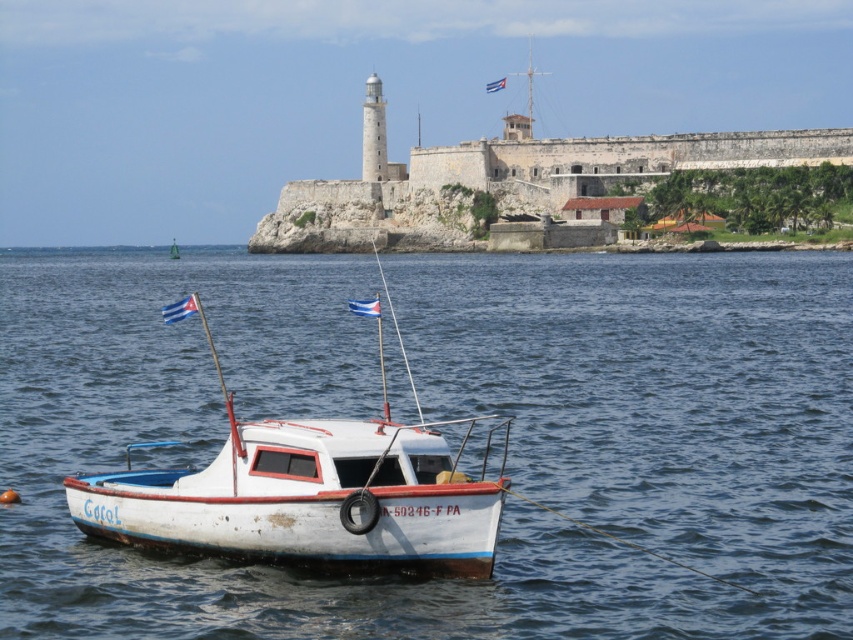
Looking at this image, does white water at boat front come in front of white matte boat at center?

Yes, white water at boat front is closer to the viewer.

This screenshot has width=853, height=640. In order to click on white water at boat front in this screenshot , I will do [447, 417].

Between point (703, 582) and point (296, 552), which one is positioned behind?

The point (703, 582) is more distant.

Where is `white water at boat front`? white water at boat front is located at coordinates (447, 417).